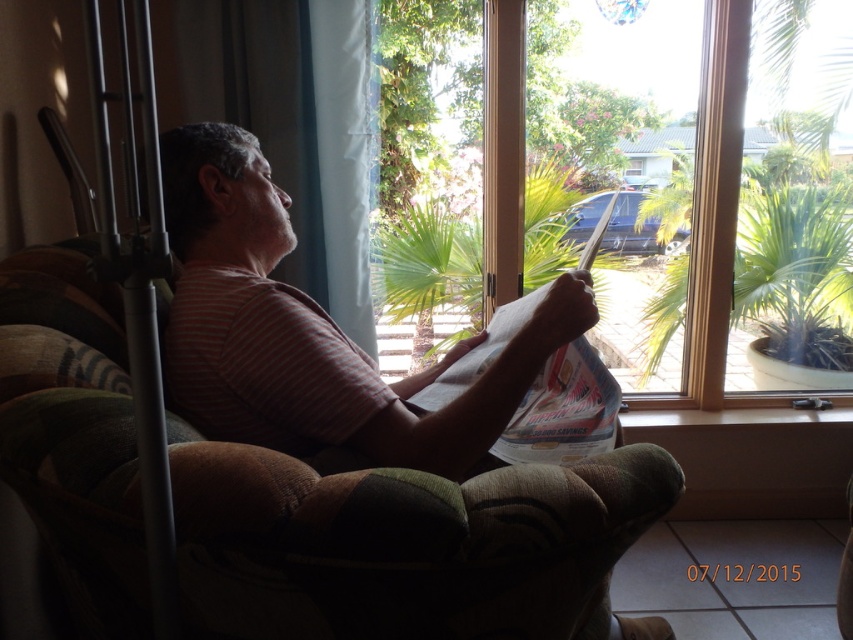
Question: Which object is the closest to the striped cotton shirt at center?

Choices:
 (A) green leafy palm tree at center
 (B) clear glass window at center
 (C) white paper at center

Answer: (C)

Question: Can you confirm if clear glass window at center is positioned to the left of striped cotton shirt at center?

Choices:
 (A) no
 (B) yes

Answer: (A)

Question: Does clear glass window at center have a smaller size compared to white paper at center?

Choices:
 (A) no
 (B) yes

Answer: (A)

Question: Which is farther from the striped cotton shirt at center?

Choices:
 (A) white paper at center
 (B) clear glass window at center

Answer: (B)

Question: Observing the image, what is the correct spatial positioning of striped cotton shirt at center in reference to green leafy palm tree at center?

Choices:
 (A) above
 (B) below

Answer: (B)

Question: Which of these objects is positioned farthest from the clear glass window at center?

Choices:
 (A) white paper at center
 (B) striped cotton shirt at center

Answer: (B)